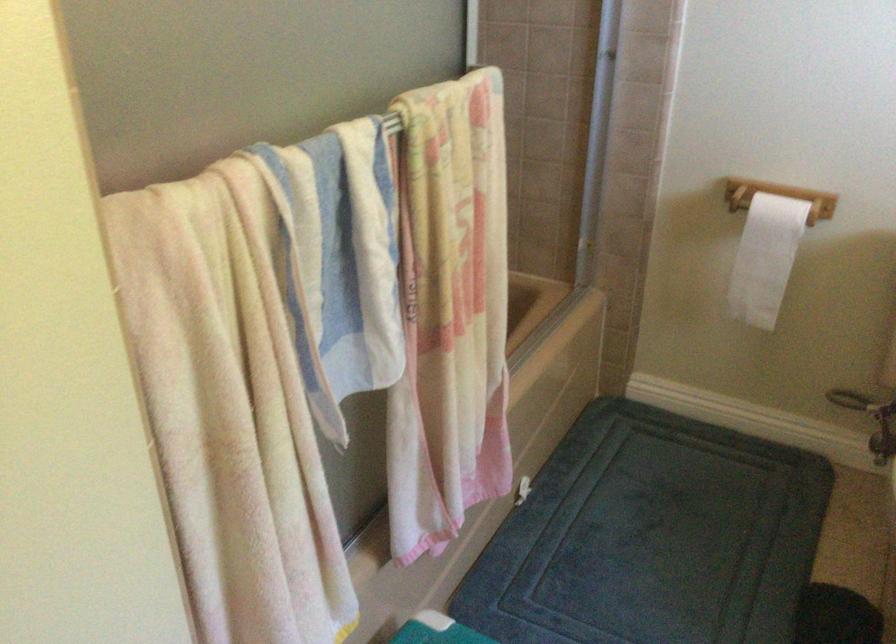
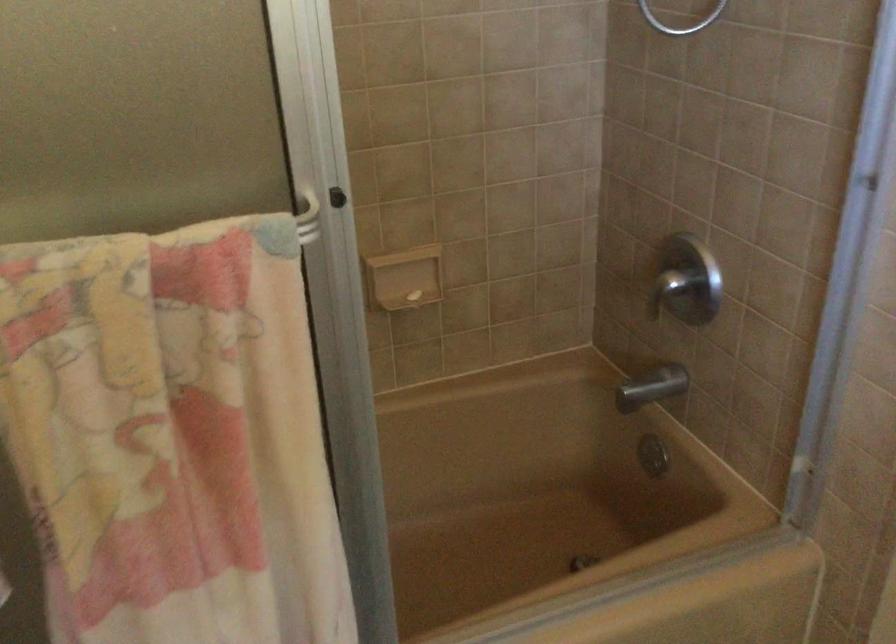
Question: The camera is either moving clockwise (left) or counter-clockwise (right) around the object. The first image is from the beginning of the video and the second image is from the end. Is the camera moving left or right when shooting the video?

Choices:
 (A) Left
 (B) Right

Answer: (B)